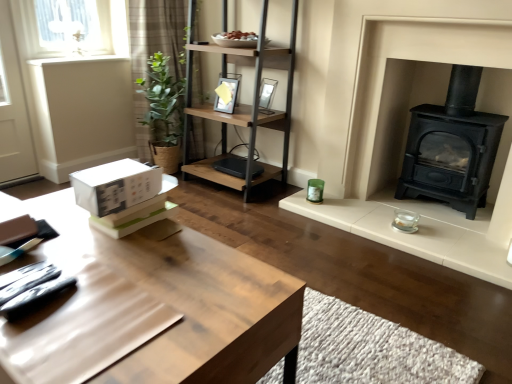
What is the approximate width of white matte cardboard box at lower left?

The width of white matte cardboard box at lower left is 12.59 inches.

Identify the location of black cast iron wood burning stove at right. Image resolution: width=512 pixels, height=384 pixels. (452, 147).

Describe the element at coordinates (153, 71) in the screenshot. I see `brown plaid curtain at upper left` at that location.

The width and height of the screenshot is (512, 384). Describe the element at coordinates (186, 299) in the screenshot. I see `light brown wooden table at center` at that location.

Where is `white matte cardboard box at lower left`? white matte cardboard box at lower left is located at coordinates (115, 186).

From a real-world perspective, relative to brown plaid curtain at upper left, is white matte cardboard box at lower left vertically above or below?

In terms of real-world spatial position, white matte cardboard box at lower left is above brown plaid curtain at upper left.

In terms of width, does white matte cardboard box at lower left look wider or thinner when compared to brown plaid curtain at upper left?

white matte cardboard box at lower left is wider than brown plaid curtain at upper left.

Is white matte cardboard box at lower left completely or partially outside of brown plaid curtain at upper left?

Yes, white matte cardboard box at lower left is located beyond the bounds of brown plaid curtain at upper left.

Is white matte cardboard box at lower left directly adjacent to brown plaid curtain at upper left?

No, white matte cardboard box at lower left is not making contact with brown plaid curtain at upper left.

Considering the relative sizes of woodenmaterial/textureshelf at center and light brown wooden table at center in the image provided, is woodenmaterial/textureshelf at center shorter than light brown wooden table at center?

No, woodenmaterial/textureshelf at center is not shorter than light brown wooden table at center.

Is woodenmaterial/textureshelf at center at the right side of light brown wooden table at center?

Yes.

From the image's perspective, is woodenmaterial/textureshelf at center located beneath light brown wooden table at center?

No.

Is woodenmaterial/textureshelf at center outside of light brown wooden table at center?

Indeed, woodenmaterial/textureshelf at center is completely outside light brown wooden table at center.

Where is `shelf located on the right of brown plaid curtain at upper left`? shelf located on the right of brown plaid curtain at upper left is located at coordinates (243, 114).

Is woodenmaterial/textureshelf at center oriented away from brown plaid curtain at upper left?

No, woodenmaterial/textureshelf at center is not facing the opposite direction of brown plaid curtain at upper left.

From a real-world perspective, is woodenmaterial/textureshelf at center located beneath brown plaid curtain at upper left?

No, from a real-world perspective, woodenmaterial/textureshelf at center is not beneath brown plaid curtain at upper left.

Which object is more forward, woodenmaterial/textureshelf at center or brown plaid curtain at upper left?

woodenmaterial/textureshelf at center is in front.

From a real-world perspective, which is physically below, matte black picture frame at upper center, the first picture frame viewed from the left, or woodenmaterial/textureshelf at center?

woodenmaterial/textureshelf at center is physically lower.

Which object is positioned more to the right, matte black picture frame at upper center, the first picture frame viewed from the left, or woodenmaterial/textureshelf at center?

From the viewer's perspective, woodenmaterial/textureshelf at center appears more on the right side.

Which object is closer to the camera, matte black picture frame at upper center, the second picture frame when ordered from right to left, or woodenmaterial/textureshelf at center?

woodenmaterial/textureshelf at center.

How many degrees apart are the facing directions of matte black picture frame at upper center, the second picture frame when ordered from right to left, and woodenmaterial/textureshelf at center?

0.472 degrees.

Between brown plaid curtain at upper left and woodenmaterial/textureshelf at center, which one has more height?

brown plaid curtain at upper left.

Is brown plaid curtain at upper left aimed at woodenmaterial/textureshelf at center?

Yes, brown plaid curtain at upper left faces towards woodenmaterial/textureshelf at center.

From the image's perspective, is brown plaid curtain at upper left under woodenmaterial/textureshelf at center?

No, from the image's perspective, brown plaid curtain at upper left is not beneath woodenmaterial/textureshelf at center.

From a real-world perspective, is brown plaid curtain at upper left positioned above or below woodenmaterial/textureshelf at center?

brown plaid curtain at upper left is situated lower than woodenmaterial/textureshelf at center in the real world.

Is matte black picture frame at upper center, the second picture frame when ordered from right to left, in contact with matte glass picture frame at upper center, placed as the 2th picture frame when sorted from left to right?

No, matte black picture frame at upper center, the second picture frame when ordered from right to left, is not touching matte glass picture frame at upper center, placed as the 2th picture frame when sorted from left to right.

Is matte black picture frame at upper center, the first picture frame viewed from the left, shorter than matte glass picture frame at upper center, placed as the first picture frame when sorted from right to left?

No.

Considering the relative sizes of matte black picture frame at upper center, the second picture frame when ordered from right to left, and matte glass picture frame at upper center, placed as the 2th picture frame when sorted from left to right, in the image provided, is matte black picture frame at upper center, the second picture frame when ordered from right to left, bigger than matte glass picture frame at upper center, placed as the 2th picture frame when sorted from left to right,?

Indeed, matte black picture frame at upper center, the second picture frame when ordered from right to left, has a larger size compared to matte glass picture frame at upper center, placed as the 2th picture frame when sorted from left to right.

Considering the relative positions of matte black picture frame at upper center, the first picture frame viewed from the left, and matte glass picture frame at upper center, placed as the first picture frame when sorted from right to left, in the image provided, is matte black picture frame at upper center, the first picture frame viewed from the left, to the right of matte glass picture frame at upper center, placed as the first picture frame when sorted from right to left, from the viewer's perspective?

Incorrect, matte black picture frame at upper center, the first picture frame viewed from the left, is not on the right side of matte glass picture frame at upper center, placed as the first picture frame when sorted from right to left.

Looking at their sizes, would you say light brown wooden table at center is wider or thinner than matte black picture frame at upper center, the second picture frame when ordered from right to left?

light brown wooden table at center is wider than matte black picture frame at upper center, the second picture frame when ordered from right to left.

Is point (129, 276) in front of point (224, 107)?

Yes, point (129, 276) is in front of point (224, 107).

Considering the relative sizes of light brown wooden table at center and matte black picture frame at upper center, the second picture frame when ordered from right to left, in the image provided, is light brown wooden table at center smaller than matte black picture frame at upper center, the second picture frame when ordered from right to left,?

Actually, light brown wooden table at center might be larger than matte black picture frame at upper center, the second picture frame when ordered from right to left.

Considering the relative positions of light brown wooden table at center and matte black picture frame at upper center, the second picture frame when ordered from right to left, in the image provided, is light brown wooden table at center to the left of matte black picture frame at upper center, the second picture frame when ordered from right to left, from the viewer's perspective?

Yes, light brown wooden table at center is to the left of matte black picture frame at upper center, the second picture frame when ordered from right to left.

Identify the location of cardboard box located below the brown plaid curtain at upper left (from the image's perspective). This screenshot has width=512, height=384. (115, 186).

The width and height of the screenshot is (512, 384). Identify the location of table beneath the woodenmaterial/textureshelf at center (from a real-world perspective). (186, 299).

Based on their spatial positions, is brown plaid curtain at upper left or matte glass picture frame at upper center, placed as the 2th picture frame when sorted from left to right, closer to matte black picture frame at upper center, the second picture frame when ordered from right to left?

matte glass picture frame at upper center, placed as the 2th picture frame when sorted from left to right, is closer to matte black picture frame at upper center, the second picture frame when ordered from right to left.

From the image, which object appears to be farther from matte glass picture frame at upper center, placed as the first picture frame when sorted from right to left, woodenmaterial/textureshelf at center or black cast iron wood burning stove at right?

black cast iron wood burning stove at right.

Looking at the image, which one is located closer to brown plaid curtain at upper left, white matte cardboard box at lower left or woodenmaterial/textureshelf at center?

woodenmaterial/textureshelf at center is positioned closer to the anchor brown plaid curtain at upper left.

Consider the image. Based on their spatial positions, is woodenmaterial/textureshelf at center or white matte cardboard box at lower left closer to black cast iron wood burning stove at right?

The object closer to black cast iron wood burning stove at right is woodenmaterial/textureshelf at center.

When comparing their distances from white matte cardboard box at lower left, does woodenmaterial/textureshelf at center or light brown wooden table at center seem closer?

Among the two, light brown wooden table at center is located nearer to white matte cardboard box at lower left.

Which object lies nearer to the anchor point matte glass picture frame at upper center, placed as the 2th picture frame when sorted from left to right, brown plaid curtain at upper left or light brown wooden table at center?

Based on the image, brown plaid curtain at upper left appears to be nearer to matte glass picture frame at upper center, placed as the 2th picture frame when sorted from left to right.

From the image, which object appears to be farther from matte black picture frame at upper center, the first picture frame viewed from the left, woodenmaterial/textureshelf at center or matte glass picture frame at upper center, placed as the first picture frame when sorted from right to left?

Among the two, woodenmaterial/textureshelf at center is located further to matte black picture frame at upper center, the first picture frame viewed from the left.

Looking at the image, which one is located closer to matte black picture frame at upper center, the first picture frame viewed from the left, black cast iron wood burning stove at right or brown plaid curtain at upper left?

Based on the image, brown plaid curtain at upper left appears to be nearer to matte black picture frame at upper center, the first picture frame viewed from the left.

Locate an element on the screen. picture frame positioned between white matte cardboard box at lower left and matte glass picture frame at upper center, placed as the first picture frame when sorted from right to left, from near to far is located at coordinates (227, 93).

In order to click on cardboard box between light brown wooden table at center and black cast iron wood burning stove at right from left to right in this screenshot , I will do `click(115, 186)`.

Locate an element on the screen. This screenshot has height=384, width=512. picture frame between brown plaid curtain at upper left and woodenmaterial/textureshelf at center in the horizontal direction is located at coordinates (227, 93).

You are a GUI agent. You are given a task and a screenshot of the screen. Output one action in this format:
    pyautogui.click(x=<x>, y=<y>)
    Task: Click on the shelf between white matte cardboard box at lower left and matte glass picture frame at upper center, placed as the first picture frame when sorted from right to left, along the z-axis
    This screenshot has width=512, height=384.
    Given the screenshot: What is the action you would take?
    pyautogui.click(x=243, y=114)